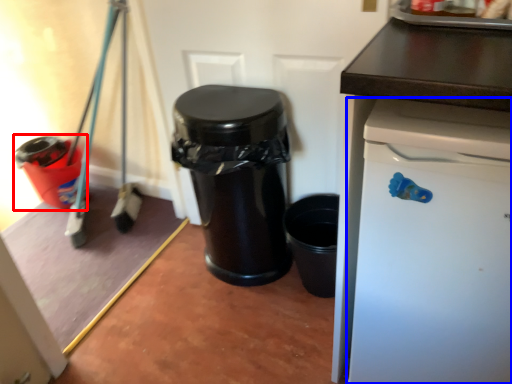
Question: Among these objects, which one is nearest to the camera, waste container (highlighted by a red box) or dish washer (highlighted by a blue box)?

Choices:
 (A) waste container
 (B) dish washer

Answer: (B)